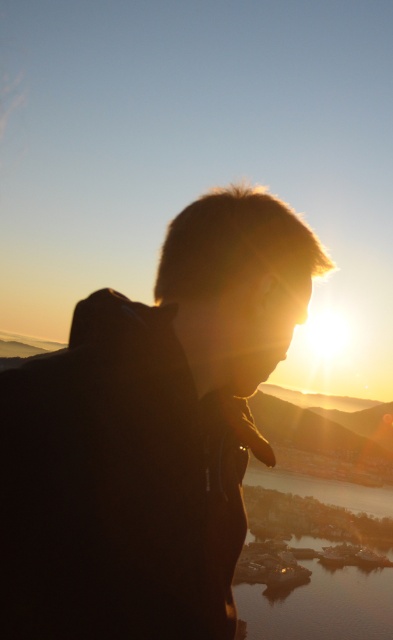
You are a photographer trying to capture the silhouette of the person in the image. You want to ensure that both the black matte jacket at center and the shiny reflective water at lower center are clearly visible in your shot. Given their sizes, which object should you focus on to ensure both are in frame?

The black matte jacket at center occupies less space than the shiny reflective water at lower center. To ensure both are in frame, focus on the shiny reflective water at lower center since it takes up more space and will help balance the composition.

You are a photographer trying to capture the silhouette of the person in the image. You want to ensure the black matte jacket at center is clearly visible against the shiny reflective water at lower center. Based on the scene, what might affect the visibility of the jacket against the water?

The black matte jacket at center is in front of the shiny reflective water at lower center, so the jacket may block the reflection, making it less visible. However, the backlighting from the sunset could create a silhouette effect that outlines the jacket against the water.

You are a delivery drone with a maximum flight range of 1000 feet. You need to deliver a package from the black matte jacket at center to the shiny reflective water at lower center. Can you complete the delivery without recharging?

The distance between the black matte jacket at center and the shiny reflective water at lower center is 1048.48 feet, which exceeds the drone s maximum flight range of 1000 feet. Therefore, the drone cannot complete the delivery without recharging.